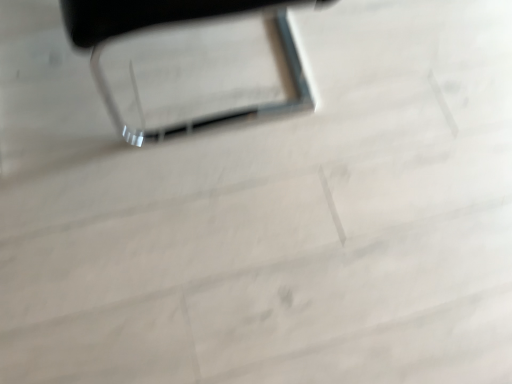
In order to click on free space below clear acrylic stand at upper center (from a real-world perspective) in this screenshot , I will do `click(212, 64)`.